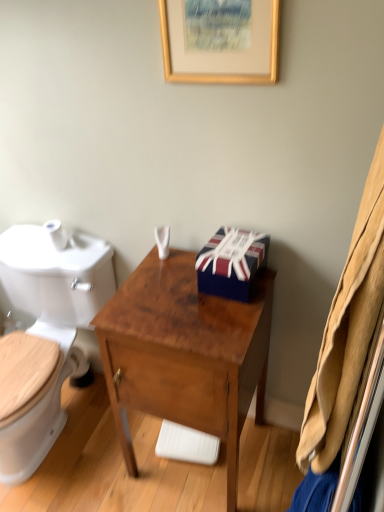
At what (x,y) coordinates should I click in order to perform the action: click on union jack-patterned gift box at center. Please return your answer as a coordinate pair (x, y). This screenshot has height=512, width=384. Looking at the image, I should click on (231, 263).

Describe the element at coordinates (185, 354) in the screenshot. This screenshot has height=512, width=384. I see `brown wood desk at center` at that location.

The width and height of the screenshot is (384, 512). Identify the location of white plastic container at center. (162, 241).

What is the approximate height of white glossy toilet at left?

white glossy toilet at left is 78.59 centimeters in height.

Describe the element at coordinates (50, 326) in the screenshot. I see `white glossy toilet at left` at that location.

The height and width of the screenshot is (512, 384). What are the coordinates of `gold wooden picture frame at upper center` in the screenshot? It's located at (220, 41).

What are the coordinates of `union jack-patterned gift box at center` in the screenshot? It's located at (231, 263).

Is white glossy toilet at left a part of union jack-patterned gift box at center?

No, union jack-patterned gift box at center does not contain white glossy toilet at left.

Where is `toilet in front of the union jack-patterned gift box at center`? toilet in front of the union jack-patterned gift box at center is located at coordinates (50, 326).

Can you confirm if union jack-patterned gift box at center is thinner than white glossy toilet at left?

Yes.

Would you say union jack-patterned gift box at center is to the left or to the right of white glossy toilet at left in the picture?

union jack-patterned gift box at center is to the right of white glossy toilet at left.

In the scene shown: Measure the distance between union jack-patterned gift box at center and white plastic container at center.

A distance of 27.61 centimeters exists between union jack-patterned gift box at center and white plastic container at center.

Would you say white plastic container at center is part of union jack-patterned gift box at center's contents?

No, white plastic container at center is not inside union jack-patterned gift box at center.

From the image's perspective, is union jack-patterned gift box at center positioned above or below white plastic container at center?

union jack-patterned gift box at center is situated lower than white plastic container at center in the image.

Between white matte toilet paper at left and union jack-patterned gift box at center, which one has smaller size?

white matte toilet paper at left is smaller.

From the image's perspective, does white matte toilet paper at left appear lower than union jack-patterned gift box at center?

No, from the image's perspective, white matte toilet paper at left is not below union jack-patterned gift box at center.

Relative to union jack-patterned gift box at center, is white matte toilet paper at left in front or behind?

white matte toilet paper at left is behind union jack-patterned gift box at center.

Is white glossy toilet at left aimed at union jack-patterned gift box at center?

No, white glossy toilet at left does not turn towards union jack-patterned gift box at center.

Choose the correct answer: Is white glossy toilet at left inside union jack-patterned gift box at center or outside it?

white glossy toilet at left cannot be found inside union jack-patterned gift box at center.

From a real-world perspective, is white glossy toilet at left beneath union jack-patterned gift box at center?

Yes, from a real-world perspective, white glossy toilet at left is under union jack-patterned gift box at center.

Locate an element on the screen. This screenshot has width=384, height=512. toilet that is on the left side of union jack-patterned gift box at center is located at coordinates (50, 326).

Which is further, (x=156, y=395) or (x=230, y=262)?

The point (x=156, y=395) is farther.

Is brown wood desk at center to the left of union jack-patterned gift box at center from the viewer's perspective?

Yes.

Measure the distance from brown wood desk at center to union jack-patterned gift box at center.

brown wood desk at center and union jack-patterned gift box at center are 9.59 inches apart from each other.

From a real-world perspective, is brown wood desk at center beneath union jack-patterned gift box at center?

Yes, from a real-world perspective, brown wood desk at center is below union jack-patterned gift box at center.

Is white plastic container at center further to the viewer compared to gold wooden picture frame at upper center?

Yes, the depth of white plastic container at center is greater than that of gold wooden picture frame at upper center.

Could you tell me if white plastic container at center is facing gold wooden picture frame at upper center?

No, white plastic container at center is not aimed at gold wooden picture frame at upper center.

Considering the relative positions of white plastic container at center and gold wooden picture frame at upper center in the image provided, is white plastic container at center to the right of gold wooden picture frame at upper center from the viewer's perspective?

Incorrect, white plastic container at center is not on the right side of gold wooden picture frame at upper center.

Considering the sizes of objects white plastic container at center and gold wooden picture frame at upper center in the image provided, who is taller, white plastic container at center or gold wooden picture frame at upper center?

gold wooden picture frame at upper center.

Is white plastic container at center positioned with its back to union jack-patterned gift box at center?

white plastic container at center does not have its back to union jack-patterned gift box at center.

In terms of size, does white plastic container at center appear bigger or smaller than union jack-patterned gift box at center?

Considering their sizes, white plastic container at center takes up less space than union jack-patterned gift box at center.

Is white plastic container at center not inside union jack-patterned gift box at center?

That's correct, white plastic container at center is outside of union jack-patterned gift box at center.

In terms of height, does white plastic container at center look taller or shorter compared to union jack-patterned gift box at center?

In the image, white plastic container at center appears to be shorter than union jack-patterned gift box at center.

Identify the location of toilet that appears below the union jack-patterned gift box at center (from a real-world perspective). (50, 326).

Locate an element on the screen. box above the white plastic container at center (from a real-world perspective) is located at coordinates (231, 263).

Looking at the image, which one is located closer to brown wood desk at center, white glossy toilet at left or white matte toilet paper at left?

Among the two, white glossy toilet at left is located nearer to brown wood desk at center.

When comparing their distances from white glossy toilet at left, does brown wood desk at center or white matte toilet paper at left seem closer?

Among the two, white matte toilet paper at left is located nearer to white glossy toilet at left.

Looking at the image, which one is located further to brown wood desk at center, white plastic container at center or white matte toilet paper at left?

white matte toilet paper at left.

When comparing their distances from union jack-patterned gift box at center, does white glossy toilet at left or gold wooden picture frame at upper center seem closer?

gold wooden picture frame at upper center lies closer to union jack-patterned gift box at center than the other object.

Looking at the image, which one is located further to white matte toilet paper at left, brown wood desk at center or gold wooden picture frame at upper center?

gold wooden picture frame at upper center is positioned further to the anchor white matte toilet paper at left.

Which object lies further to the anchor point white matte toilet paper at left, union jack-patterned gift box at center or white glossy toilet at left?

Based on the image, union jack-patterned gift box at center appears to be further to white matte toilet paper at left.

When comparing their distances from white glossy toilet at left, does brown wood desk at center or union jack-patterned gift box at center seem closer?

brown wood desk at center is positioned closer to the anchor white glossy toilet at left.

When comparing their distances from union jack-patterned gift box at center, does brown wood desk at center or white matte toilet paper at left seem closer?

Among the two, brown wood desk at center is located nearer to union jack-patterned gift box at center.

The image size is (384, 512). In order to click on toiletries between gold wooden picture frame at upper center and white glossy toilet at left in the up-down direction in this screenshot , I will do `click(162, 241)`.

Identify the location of toiletries between white matte toilet paper at left and union jack-patterned gift box at center. coord(162,241).

Locate an element on the screen. The width and height of the screenshot is (384, 512). toilet paper between white glossy toilet at left and white plastic container at center is located at coordinates (56, 234).

Identify the location of box between gold wooden picture frame at upper center and white glossy toilet at left in the vertical direction. (231, 263).